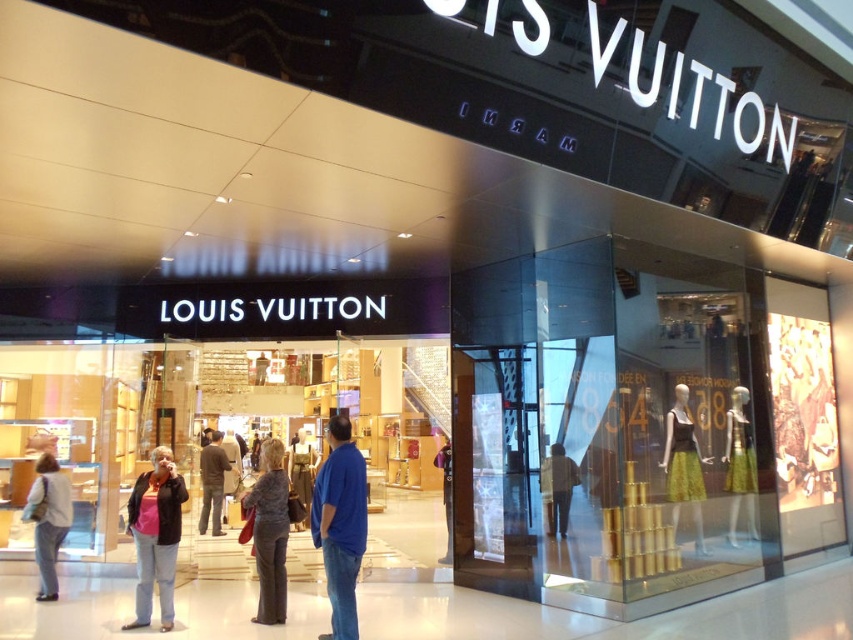
In the scene shown: You are standing at the entrance of the Louis Vuitton store and want to take a photo of the two points inside the store. Which point, point [343,449] or point [218,452], will appear larger in your photo?

Point [343,449] will appear larger in the photo because it is closer to the camera than point [218,452].

You are standing at the entrance of the Louis Vuitton store and want to walk towards the point labeled as point (276, 536). Which direction should you move relative to the other point labeled as point (567, 458)?

You should move towards the point (276, 536), which is in front of the point (567, 458).